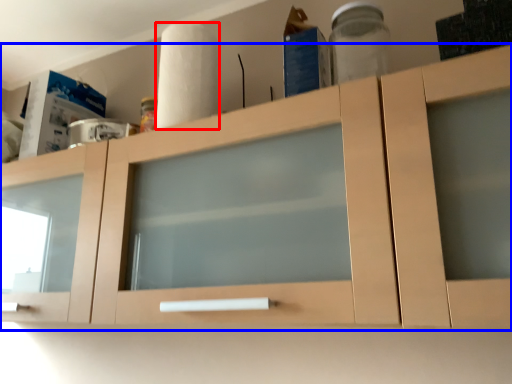
Question: Which of the following is the closest to the observer, paper towel (highlighted by a red box) or cabinetry (highlighted by a blue box)?

Choices:
 (A) paper towel
 (B) cabinetry

Answer: (B)